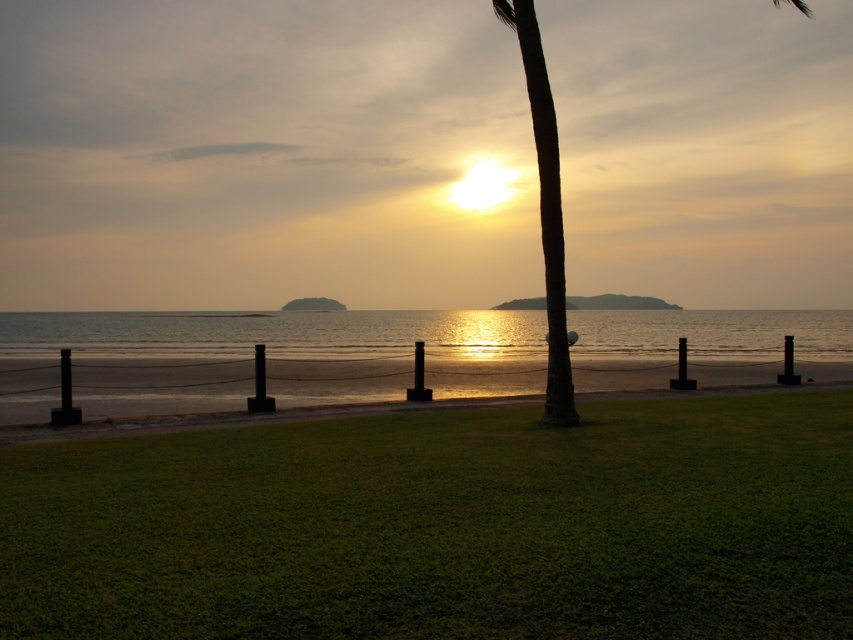
You are planning to set up a picnic blanket on the beach. You have a picnic basket that is 1.5 meters wide. Considering the space between the green grass at center and the green leafy palm tree at center, will your picnic basket fit there?

The green grass at center is wider than the green leafy palm tree at center. However, the description does not provide specific measurements of their widths, so it is unclear if the 1.5 meter picnic basket will fit between them. Additional information about the actual widths is needed to determine this.

You are a photographer wanting to capture the sunset with both the green grass at center and the green leafy palm tree at center in your shot. Which object will appear taller in the photo?

The green leafy palm tree at center appears taller in the photo because it is taller than the green grass at center.